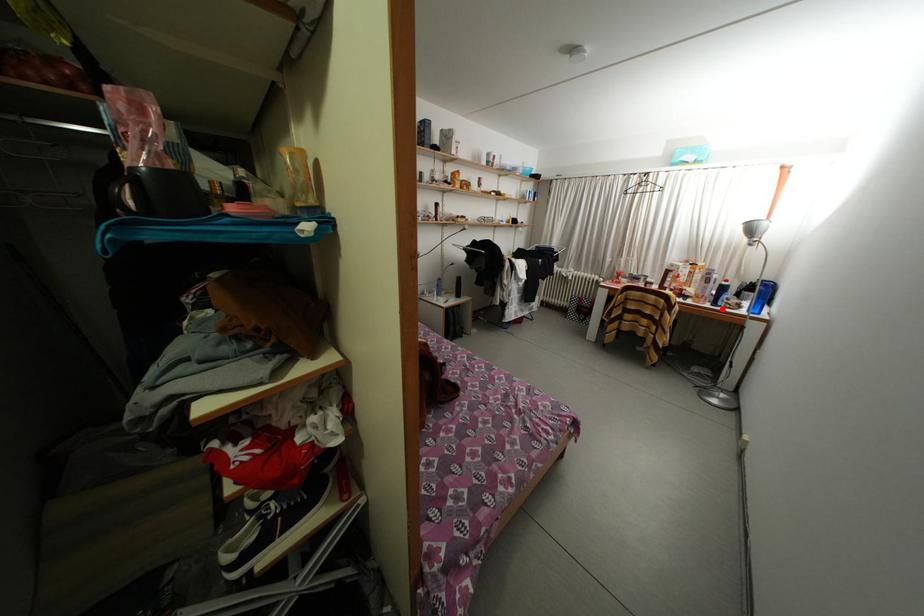
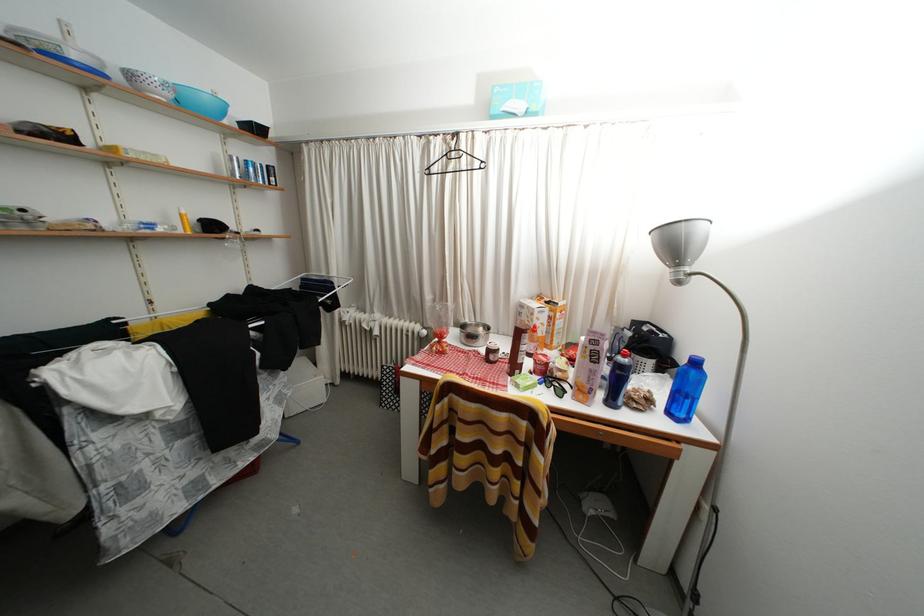
Question: I am providing you with two images of the same scene from different viewpoints. Given a red point in image1, look at the same physical point in image2. Is it:

Choices:
 (A) Closer to the viewpoint
 (B) Farther from the viewpoint

Answer: (B)